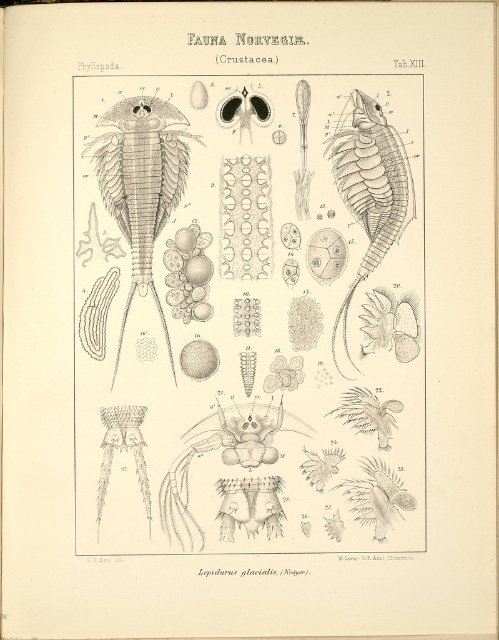
Question: Does grayish-brown crustacean at center-left appear over translucent gray crustacean at center-right?

Choices:
 (A) no
 (B) yes

Answer: (A)

Question: Which of the following is the closest to the observer?

Choices:
 (A) grayish-brown crustacean at center-left
 (B) translucent gray crustacean at center-right

Answer: (A)

Question: Does grayish-brown crustacean at center-left appear under translucent gray crustacean at center-right?

Choices:
 (A) yes
 (B) no

Answer: (A)

Question: Is grayish-brown crustacean at center-left above translucent gray crustacean at center-right?

Choices:
 (A) yes
 (B) no

Answer: (B)